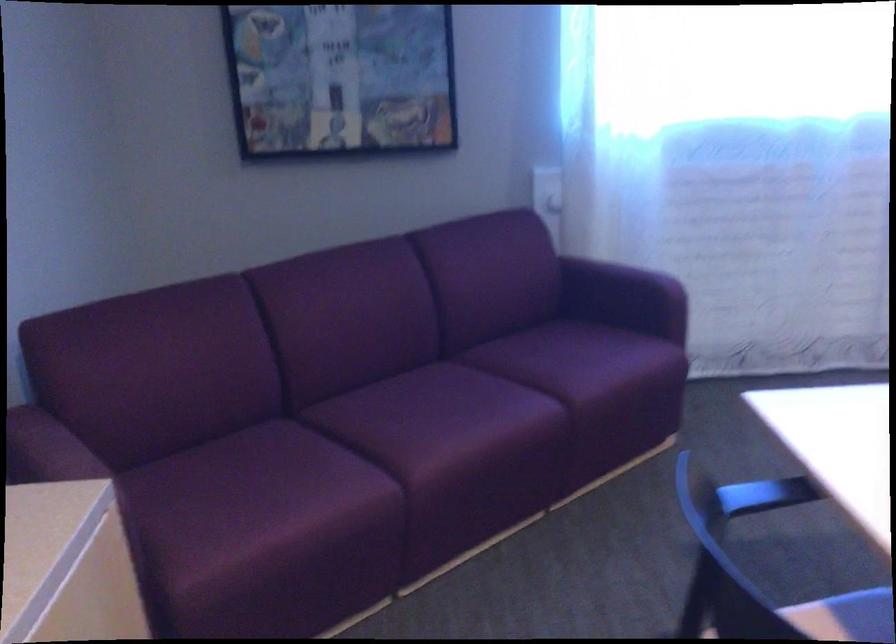
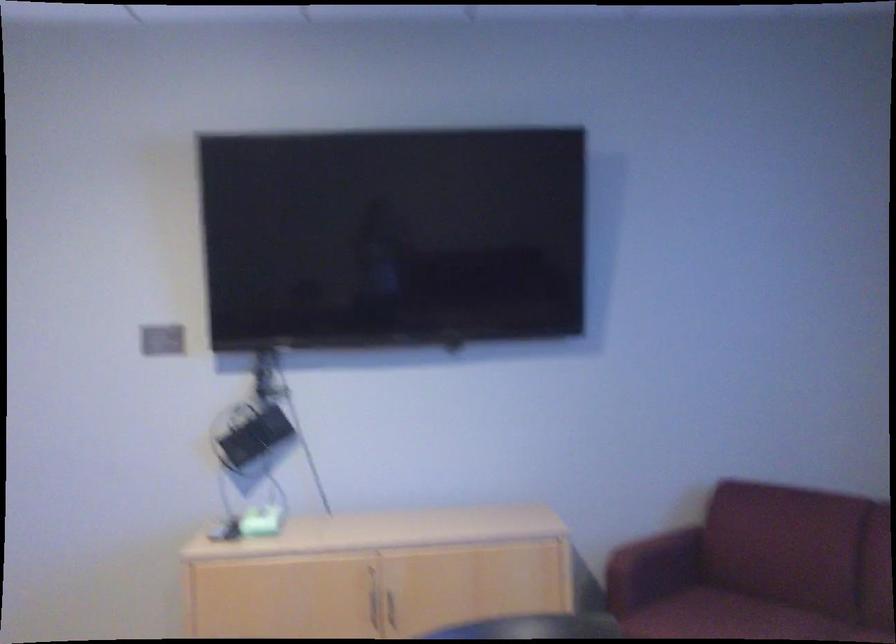
The point at (254, 474) is marked in the first image. Where is the corresponding point in the second image?

(722, 616)